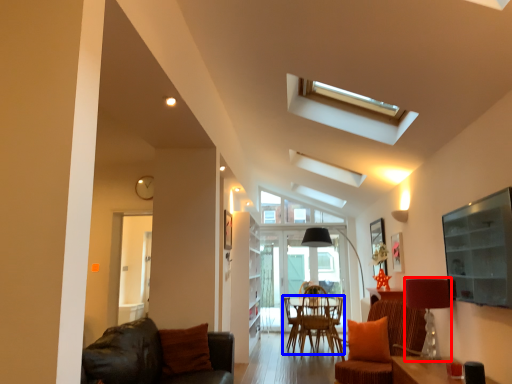
Question: Which object appears farthest to the camera in this image, lamp (highlighted by a red box) or chair (highlighted by a blue box)?

Choices:
 (A) lamp
 (B) chair

Answer: (B)